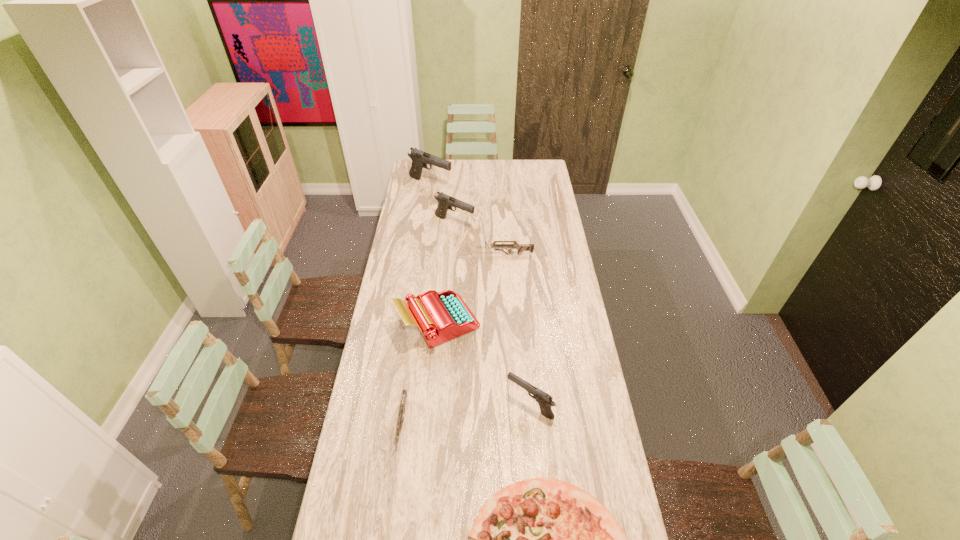
Where is `the farthest object`? The image size is (960, 540). the farthest object is located at coordinates (420, 159).

This screenshot has height=540, width=960. Identify the location of the tallest gun. (420, 159).

Locate an element on the screen. The height and width of the screenshot is (540, 960). the second farthest object is located at coordinates (x=445, y=202).

This screenshot has width=960, height=540. Identify the location of the second smallest black gun. (445, 202).

At what (x,y) coordinates should I click in order to perform the action: click on typewriter. Please return your answer as a coordinate pair (x, y). Looking at the image, I should click on (441, 316).

The height and width of the screenshot is (540, 960). Identify the location of the fourth tallest object. (544, 400).

The width and height of the screenshot is (960, 540). In order to click on the rightmost black gun in this screenshot , I will do `click(544, 400)`.

Locate an element on the screen. the third nearest gun is located at coordinates (498, 247).

Locate an element on the screen. The width and height of the screenshot is (960, 540). the fifth nearest object is located at coordinates (498, 247).

At what (x,y) coordinates should I click in order to perform the action: click on the smaller grey gun. Please return your answer as a coordinate pair (x, y). This screenshot has width=960, height=540. Looking at the image, I should click on point(404,394).